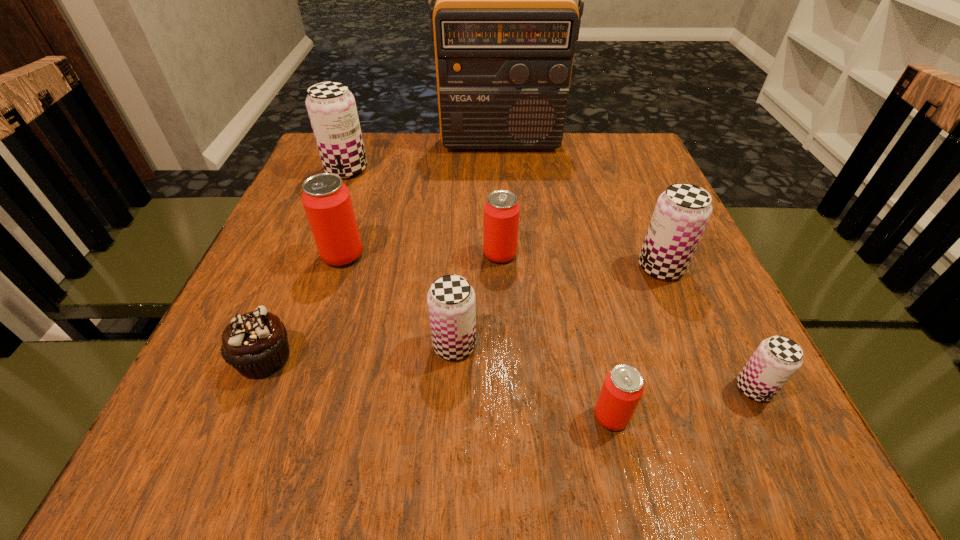
Where is `free region located 0.310m on the back of the smallest purple beer can`? free region located 0.310m on the back of the smallest purple beer can is located at coordinates (681, 241).

Locate an element on the screen. The image size is (960, 540). vacant area located 0.150m on the back of the smallest red beer can is located at coordinates (589, 321).

I want to click on blank area located 0.250m on the back of the cupcake, so click(315, 237).

Find the location of `radio receiver located at the far edge`. radio receiver located at the far edge is located at coordinates (504, 26).

Where is `beer can that is positioned at the far edge`? The width and height of the screenshot is (960, 540). beer can that is positioned at the far edge is located at coordinates (331, 107).

Identify the location of object positioned at the near edge. This screenshot has width=960, height=540. (623, 387).

You are a GUI agent. You are given a task and a screenshot of the screen. Output one action in this format:
    pyautogui.click(x=<x>, y=<y>)
    Task: Click on the cupcake located in the left edge section of the desktop
    The height and width of the screenshot is (540, 960).
    Given the screenshot: What is the action you would take?
    pyautogui.click(x=256, y=344)

Where is `object located in the far left corner section of the desktop`? This screenshot has height=540, width=960. object located in the far left corner section of the desktop is located at coordinates (331, 107).

The height and width of the screenshot is (540, 960). I want to click on free spot at the far edge of the desktop, so click(393, 156).

Where is `vacant point at the near edge`? The height and width of the screenshot is (540, 960). vacant point at the near edge is located at coordinates (639, 433).